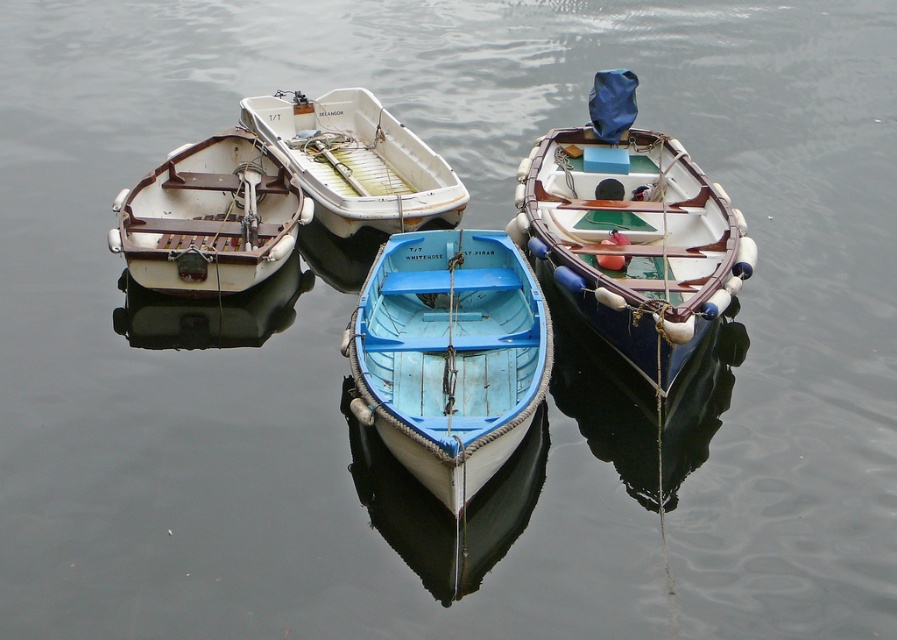
In the scene shown: Does wooden boat at center have a greater width compared to white matte boat at left?

Correct, the width of wooden boat at center exceeds that of white matte boat at left.

You are a GUI agent. You are given a task and a screenshot of the screen. Output one action in this format:
    pyautogui.click(x=<x>, y=<y>)
    Task: Click on the wooden boat at center
    
    Given the screenshot: What is the action you would take?
    pyautogui.click(x=632, y=230)

Locate an element on the screen. The image size is (897, 640). wooden boat at center is located at coordinates (632, 230).

Does blue matte boat at center appear over white matte boat at left?

Incorrect, blue matte boat at center is not positioned above white matte boat at left.

Between blue matte boat at center and white matte boat at left, which one is positioned higher?

white matte boat at left

Measure the distance between point (x=419, y=310) and camera.

They are 12.04 meters apart.

Locate an element on the screen. The image size is (897, 640). blue matte boat at center is located at coordinates (449, 355).

Who is higher up, wooden boat at center or white matte boat at upper center?

white matte boat at upper center is higher up.

Does wooden boat at center have a greater height compared to white matte boat at upper center?

Indeed, wooden boat at center has a greater height compared to white matte boat at upper center.

Is point (542, 252) closer to camera compared to point (355, 214)?

Yes, point (542, 252) is in front of point (355, 214).

This screenshot has height=640, width=897. I want to click on wooden boat at center, so click(632, 230).